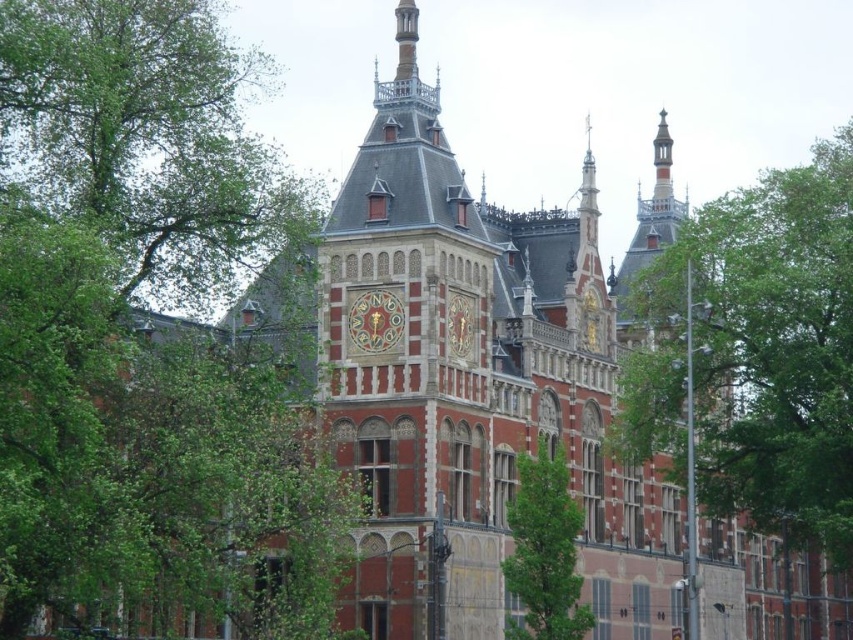
Question: Which object is the closest to the green leafy tree at lower right?

Choices:
 (A) green leafy tree at right
 (B) green leafy tree at upper left

Answer: (A)

Question: From the image, what is the correct spatial relationship of green leafy tree at upper left in relation to green leafy tree at right?

Choices:
 (A) right
 (B) left

Answer: (B)

Question: In this image, where is green leafy tree at upper left located relative to green leafy tree at right?

Choices:
 (A) left
 (B) right

Answer: (A)

Question: Does green leafy tree at upper left appear on the left side of green leafy tree at lower right?

Choices:
 (A) no
 (B) yes

Answer: (B)

Question: Estimate the real-world distances between objects in this image. Which object is farther from the green leafy tree at right?

Choices:
 (A) green leafy tree at upper left
 (B) green leafy tree at lower right

Answer: (A)

Question: Which point appears farthest from the camera in this image?

Choices:
 (A) (151, 35)
 (B) (578, 636)
 (C) (747, 368)

Answer: (C)